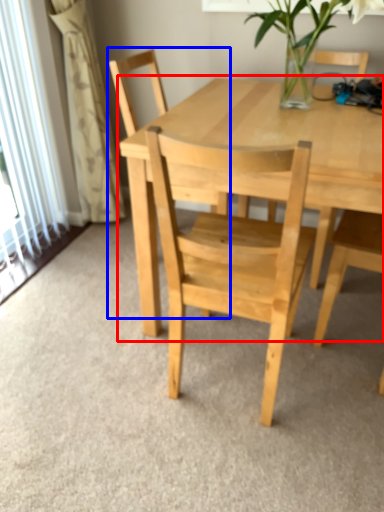
Question: Among these objects, which one is nearest to the camera, round table (highlighted by a red box) or chair (highlighted by a blue box)?

Choices:
 (A) round table
 (B) chair

Answer: (A)